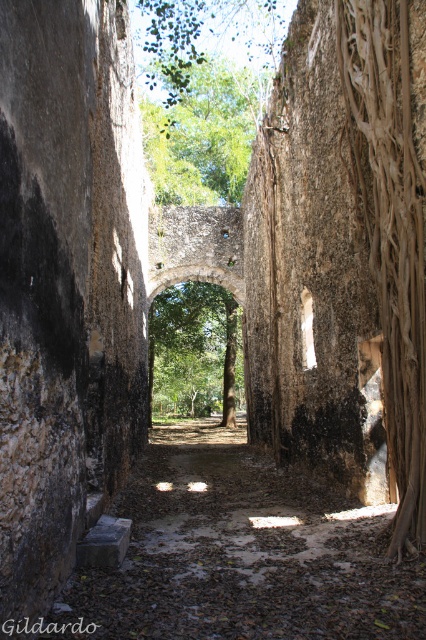
Question: Is green leafy tree at upper center wider than green leafy archway at center?

Choices:
 (A) no
 (B) yes

Answer: (B)

Question: Which object is positioned farthest from the brown rough tree root at right?

Choices:
 (A) green leafy tree at upper center
 (B) green leafy archway at center

Answer: (B)

Question: Which of the following is the farthest from the observer?

Choices:
 (A) green leafy tree at upper center
 (B) brown rough tree root at right
 (C) green leafy archway at center

Answer: (A)

Question: Which object is positioned closest to the brown rough tree root at right?

Choices:
 (A) green leafy archway at center
 (B) green leafy tree at upper center

Answer: (B)

Question: Does brown rough tree root at right appear on the left side of green leafy tree at upper center?

Choices:
 (A) yes
 (B) no

Answer: (B)

Question: Is green leafy tree at upper center below green leafy archway at center?

Choices:
 (A) no
 (B) yes

Answer: (A)